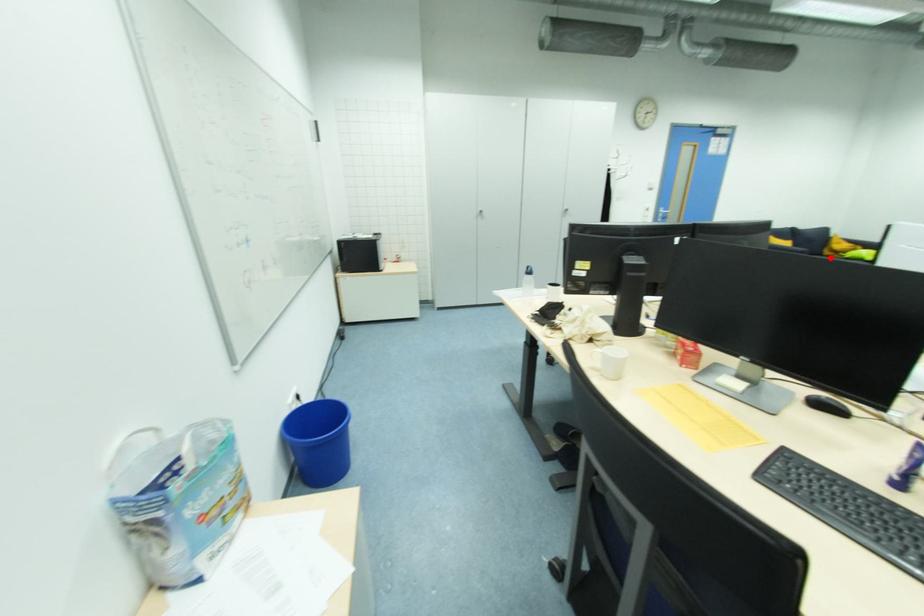
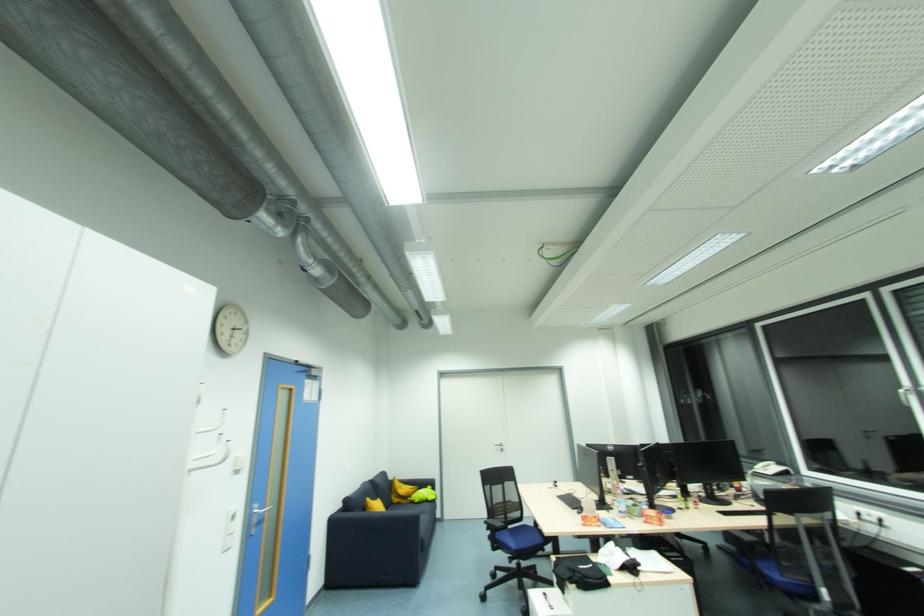
Question: A red point is marked in image1. In image2, is the corresponding 3D point closer to the camera or farther? Reply with the corresponding letter.

Choices:
 (A) The corresponding 3D point is closer.
 (B) The corresponding 3D point is farther.

Answer: (A)